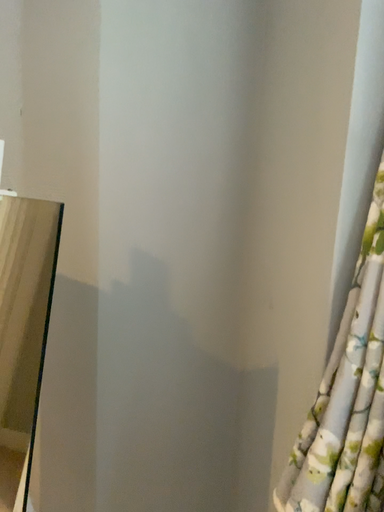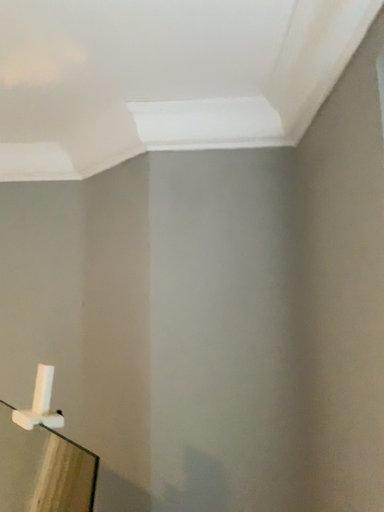
Question: Which way did the camera rotate in the video?

Choices:
 (A) rotated downward
 (B) rotated upward

Answer: (B)